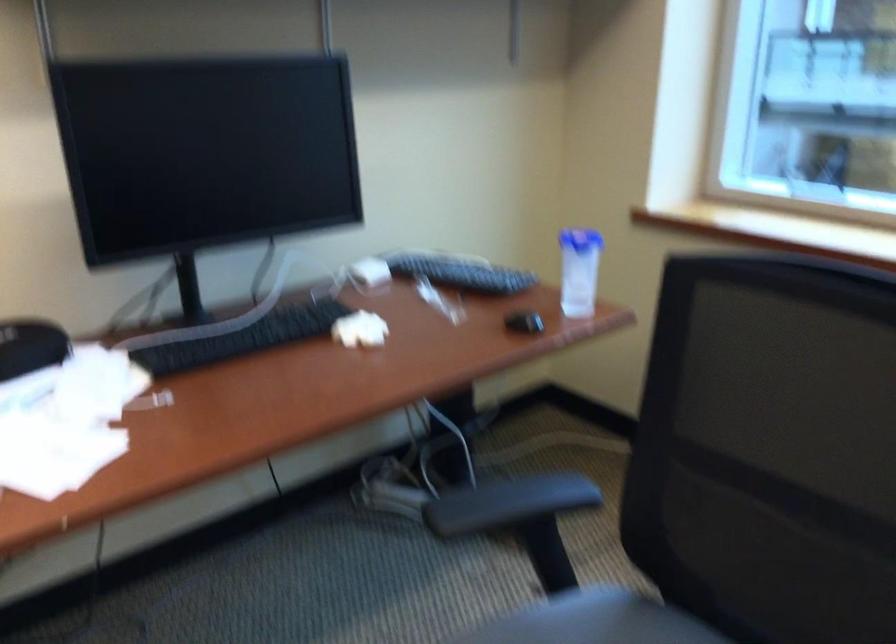
The height and width of the screenshot is (644, 896). Identify the location of chair sitting surface. (593, 621).